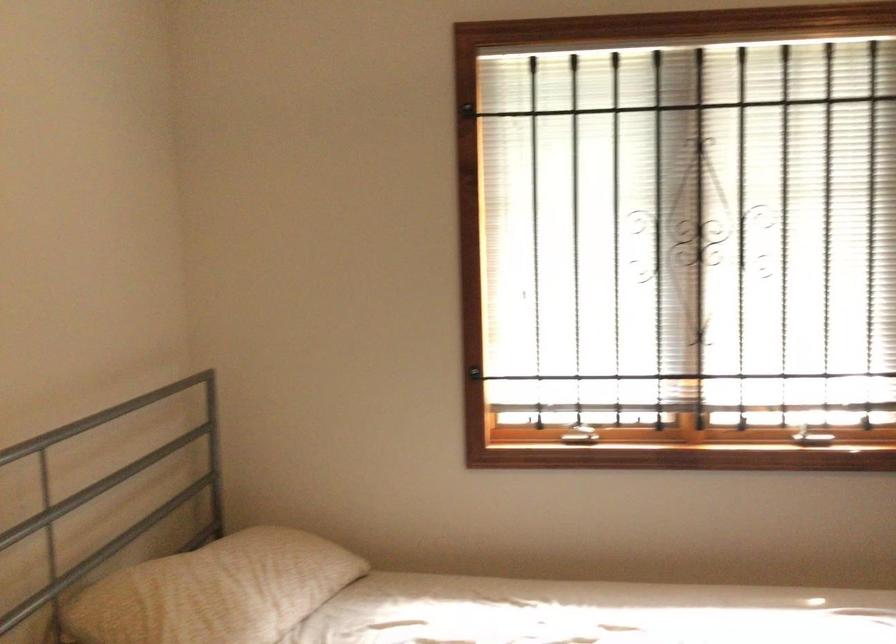
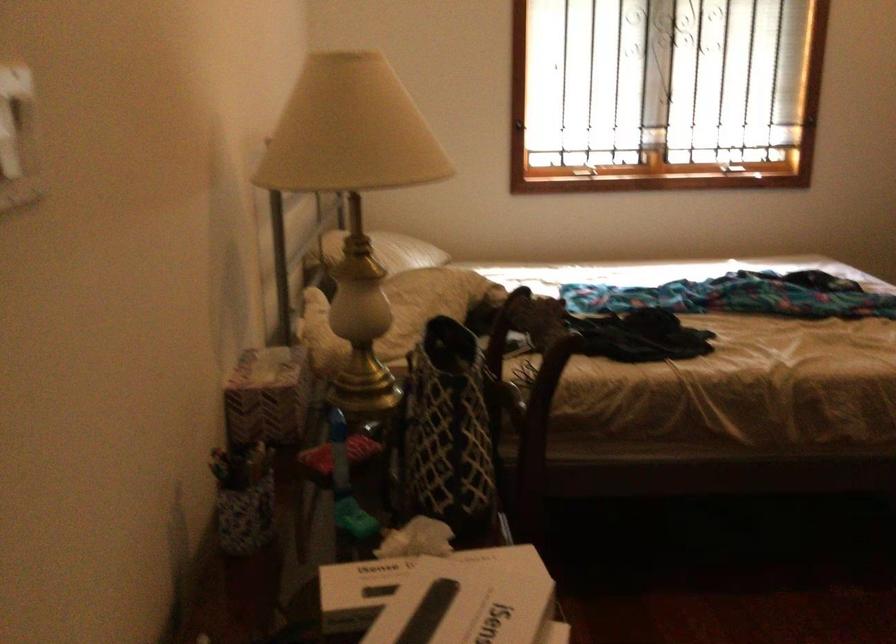
Find the pixel in the second image that matches [455,386] in the first image.

(520, 124)